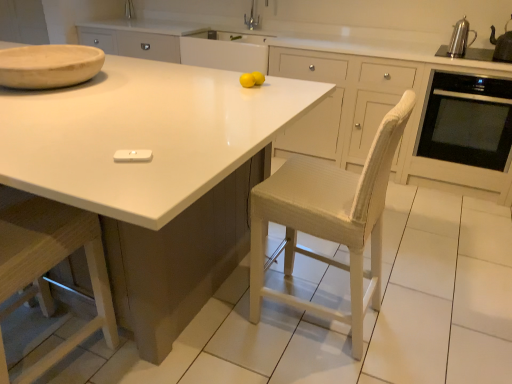
Locate an element on the screen. free space to the back side of white matte remote control at center, which appears as the first appliance when viewed from the front is located at coordinates (150, 139).